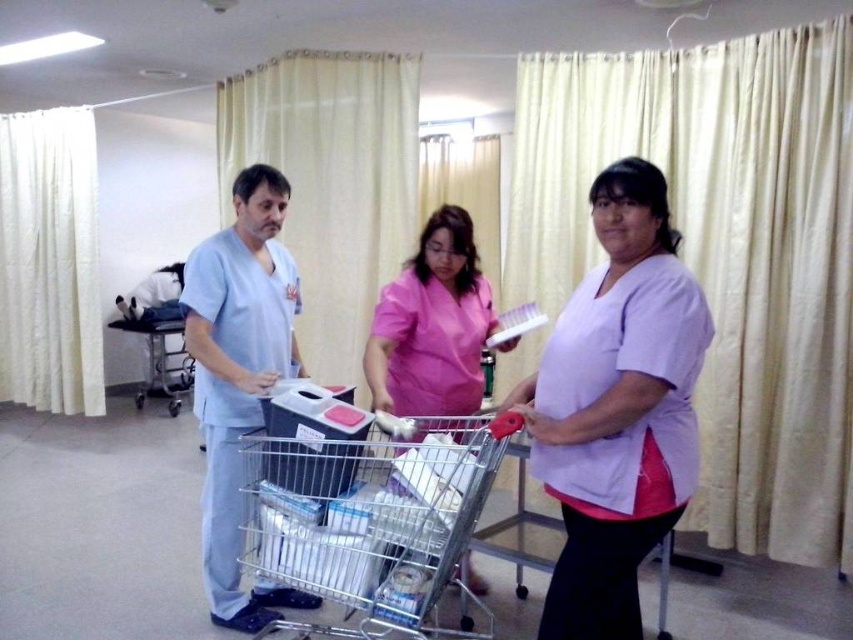
Does metallic silver trolley at center lie behind light blue scrubs at center?

No, it is in front of light blue scrubs at center.

Is metallic silver trolley at center above light blue scrubs at center?

Incorrect, metallic silver trolley at center is not positioned above light blue scrubs at center.

Find the location of a particular element. metallic silver trolley at center is located at coordinates (376, 522).

Which is behind, point (202, 259) or point (171, 403)?

Point (171, 403)

Which is more to the right, light blue scrubs at center or metallic silver trolley at left?

From the viewer's perspective, light blue scrubs at center appears more on the right side.

Identify the location of light blue scrubs at center. This screenshot has height=640, width=853. pyautogui.click(x=239, y=376).

Is light blue scrubs at center to the left of pink fabric shirt at center from the viewer's perspective?

Yes, light blue scrubs at center is to the left of pink fabric shirt at center.

Is light blue scrubs at center closer to camera compared to pink fabric shirt at center?

Yes, light blue scrubs at center is closer to the viewer.

Is point (265, 252) in front of point (436, 380)?

No, (265, 252) is behind (436, 380).

This screenshot has width=853, height=640. In order to click on light blue scrubs at center in this screenshot , I will do `click(239, 376)`.